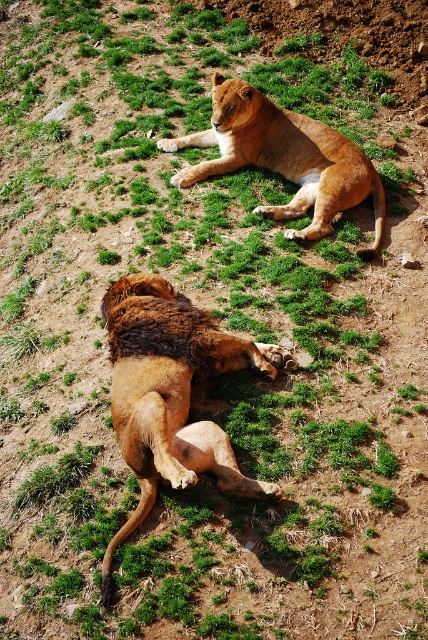
Question: Can you confirm if brown shaggy lion at lower left is thinner than golden fur lion at upper center?

Choices:
 (A) no
 (B) yes

Answer: (B)

Question: Which object is farther from the camera taking this photo?

Choices:
 (A) brown shaggy lion at lower left
 (B) golden fur lion at upper center

Answer: (B)

Question: Does brown shaggy lion at lower left have a lesser width compared to golden fur lion at upper center?

Choices:
 (A) yes
 (B) no

Answer: (A)

Question: Is brown shaggy lion at lower left bigger than golden fur lion at upper center?

Choices:
 (A) yes
 (B) no

Answer: (A)

Question: Which point appears farthest from the camera in this image?

Choices:
 (A) (312, 140)
 (B) (250, 486)

Answer: (A)